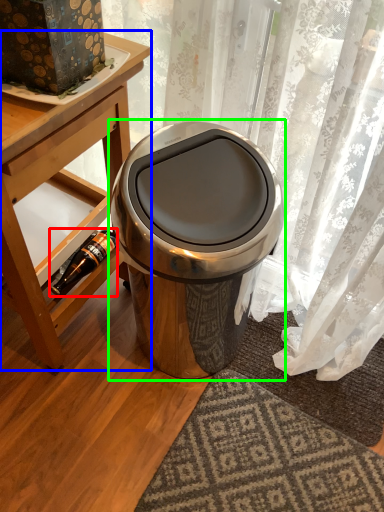
Question: Which object is the farthest from bottle (highlighted by a red box)? Choose among these: table (highlighted by a blue box) or waste container (highlighted by a green box).

Choices:
 (A) table
 (B) waste container

Answer: (B)